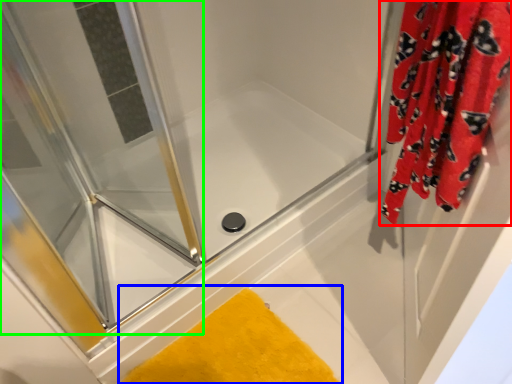
Question: Based on their relative distances, which object is farther from curtain (highlighted by a red box)? Choose from bath mat (highlighted by a blue box) and screen door (highlighted by a green box).

Choices:
 (A) bath mat
 (B) screen door

Answer: (B)